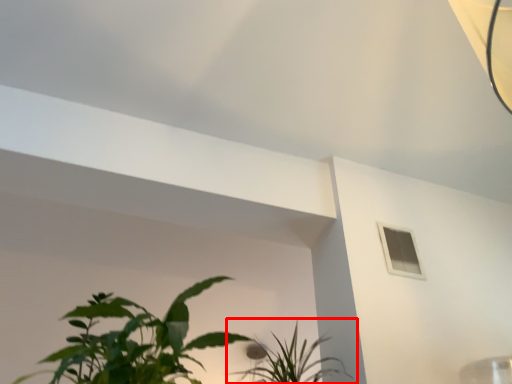
Question: From the image's perspective, what is the correct spatial positioning of houseplant (annotated by the red box) in reference to window?

Choices:
 (A) below
 (B) above

Answer: (A)